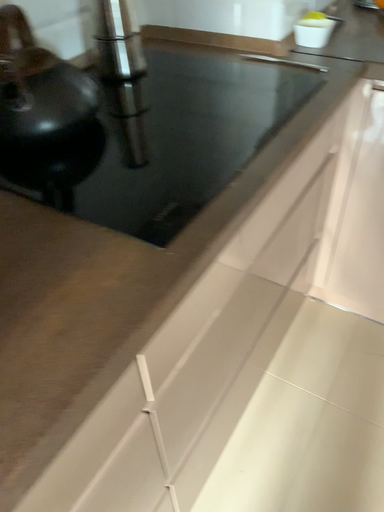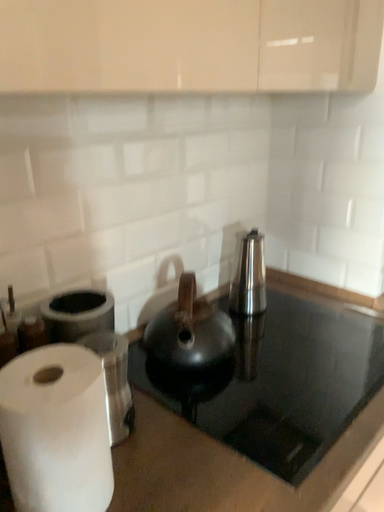
Question: Which way did the camera rotate in the video?

Choices:
 (A) rotated downward
 (B) rotated upward

Answer: (B)